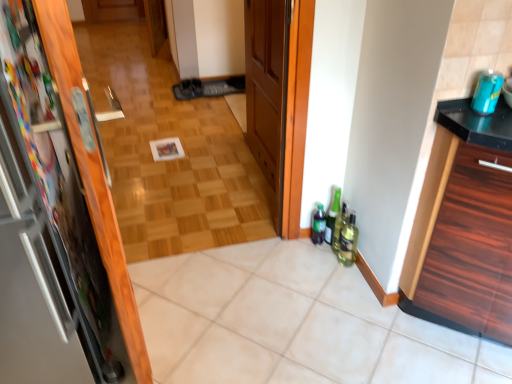
Question: Should I look upward or downward to see green glass bottle at lower right, positioned as the 3th bottle in left-to-right order?

Choices:
 (A) down
 (B) up

Answer: (A)

Question: Is metallic refrigerator at left, the 2th door viewed from the back, to the left of teal matte can at upper right, the first beverage in the front-to-back sequence, from the viewer's perspective?

Choices:
 (A) yes
 (B) no

Answer: (A)

Question: Are metallic refrigerator at left, the 1th door in the front-to-back sequence, and teal matte can at upper right, the 2th beverage positioned from the left, beside each other?

Choices:
 (A) yes
 (B) no

Answer: (B)

Question: Is metallic refrigerator at left, which is the first door from left to right, smaller than teal matte can at upper right, the first beverage in the front-to-back sequence?

Choices:
 (A) yes
 (B) no

Answer: (B)

Question: Does metallic refrigerator at left, the 1th door in the front-to-back sequence, have a lesser width compared to teal matte can at upper right, the first beverage in the front-to-back sequence?

Choices:
 (A) yes
 (B) no

Answer: (B)

Question: From the image's perspective, is metallic refrigerator at left, which is the first door from left to right, located beneath teal matte can at upper right, acting as the first beverage starting from the top?

Choices:
 (A) no
 (B) yes

Answer: (B)

Question: Can teal matte can at upper right, placed as the first beverage when sorted from right to left, be found inside metallic refrigerator at left, which appears as the second door when viewed from the right?

Choices:
 (A) yes
 (B) no

Answer: (B)

Question: Considering the relative positions of metallic refrigerator at left, the 1th door in the front-to-back sequence, and white tile at center in the image provided, is metallic refrigerator at left, the 1th door in the front-to-back sequence, to the left of white tile at center from the viewer's perspective?

Choices:
 (A) no
 (B) yes

Answer: (B)

Question: Does metallic refrigerator at left, which appears as the second door when viewed from the right, have a smaller size compared to white tile at center?

Choices:
 (A) no
 (B) yes

Answer: (A)

Question: Is metallic refrigerator at left, which is the first door from left to right, behind white tile at center?

Choices:
 (A) no
 (B) yes

Answer: (A)

Question: Can you confirm if metallic refrigerator at left, the 2th door viewed from the back, is thinner than white tile at center?

Choices:
 (A) yes
 (B) no

Answer: (A)

Question: Is metallic refrigerator at left, the 2th door viewed from the back, positioned far away from white tile at center?

Choices:
 (A) yes
 (B) no

Answer: (B)

Question: Considering the relative sizes of metallic refrigerator at left, which is the first door from left to right, and white tile at center in the image provided, is metallic refrigerator at left, which is the first door from left to right, shorter than white tile at center?

Choices:
 (A) no
 (B) yes

Answer: (A)

Question: Considering the relative positions of black wood cabinet at right and green glass bottle at lower right, which is the 1th bottle in right-to-left order, in the image provided, is black wood cabinet at right to the left of green glass bottle at lower right, which is the 1th bottle in right-to-left order, from the viewer's perspective?

Choices:
 (A) yes
 (B) no

Answer: (B)